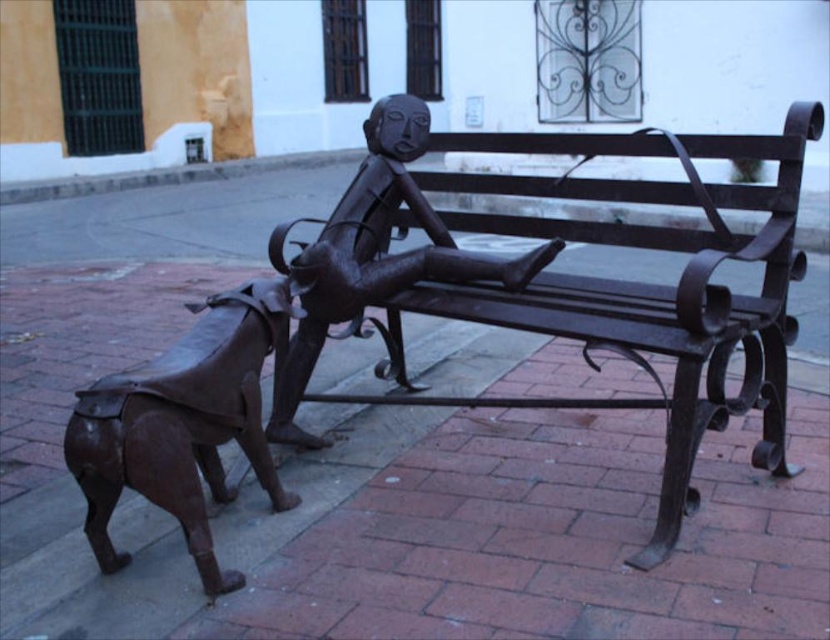
You are an art student who wants to sketch the bronze figure at center and the brown polished metal dog at lower left. From your current position, which object is positioned to the left of the other?

The brown polished metal dog at lower left is to the left of bronze figure at center, so the dog is positioned to the left of the figure.

You are standing at the center of the paved area with red bricks. You want to find the bronze dog at lower left. Which direction should you look to locate it?

You should look towards the lower left direction to find the bronze dog at lower left, as it is located at point (259, 356).